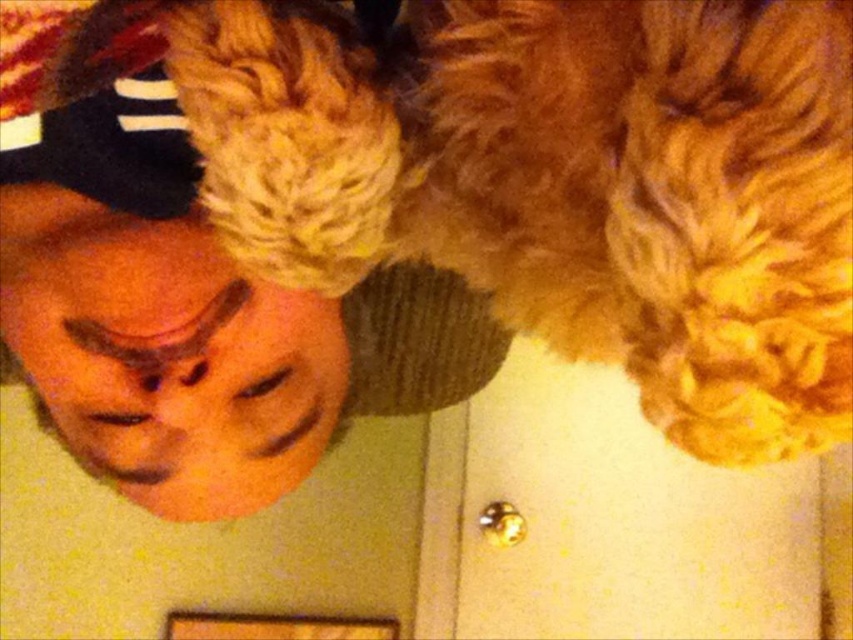
Which of these two, fuzzy golden cat at upper center or matte black cap at upper left, stands shorter?

With less height is fuzzy golden cat at upper center.

Which is behind, point (602, 141) or point (27, 134)?

The point (27, 134) is behind.

Is point (271, 182) closer to camera compared to point (105, 292)?

That is True.

You are a GUI agent. You are given a task and a screenshot of the screen. Output one action in this format:
    pyautogui.click(x=<x>, y=<y>)
    Task: Click on the fuzzy golden cat at upper center
    The width and height of the screenshot is (853, 640).
    Given the screenshot: What is the action you would take?
    pyautogui.click(x=567, y=186)